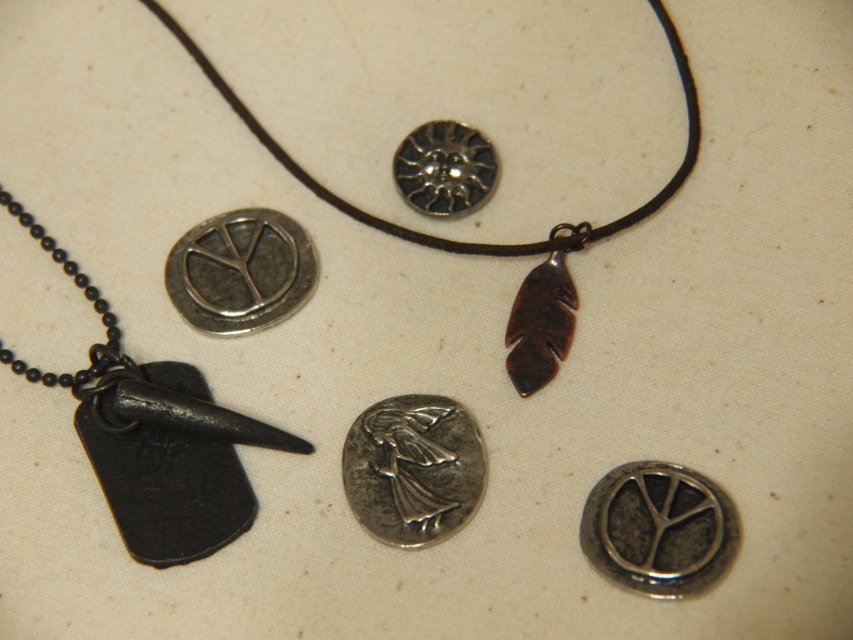
Question: Estimate the real-world distances between objects in this image. Which object is farther from the silver metallic coin at center?

Choices:
 (A) rusty metal feather at center
 (B) silver metallic sun at upper center

Answer: (B)

Question: Which object is the closest to the silver metallic peace sign at center-left?

Choices:
 (A) silver metallic coin at center
 (B) rusty metal feather at center
 (C) silver metallic sun at upper center

Answer: (C)

Question: From the image, what is the correct spatial relationship of antique silver pendant at upper center in relation to rusty metal feather at center?

Choices:
 (A) above
 (B) below

Answer: (A)

Question: Does silver metallic coin at center have a smaller size compared to silver metallic peace sign at upper center?

Choices:
 (A) no
 (B) yes

Answer: (A)

Question: Does silver metallic coin at center appear on the left side of rusty metal feather at center?

Choices:
 (A) yes
 (B) no

Answer: (A)

Question: Which object is the closest to the silver metallic sun at upper center?

Choices:
 (A) silver metallic coin at center
 (B) silver metallic peace sign at center-left
 (C) silver metallic peace sign at upper center

Answer: (B)